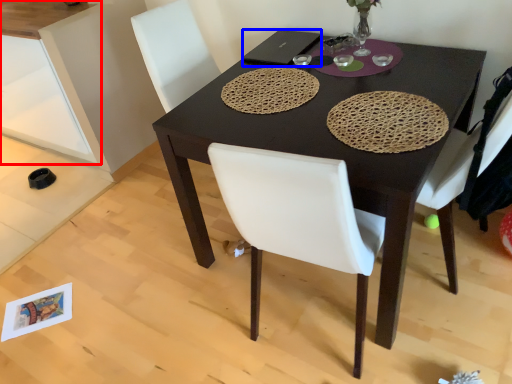
Question: Which object is further to the camera taking this photo, cabinetry (highlighted by a red box) or laptop (highlighted by a blue box)?

Choices:
 (A) cabinetry
 (B) laptop

Answer: (A)